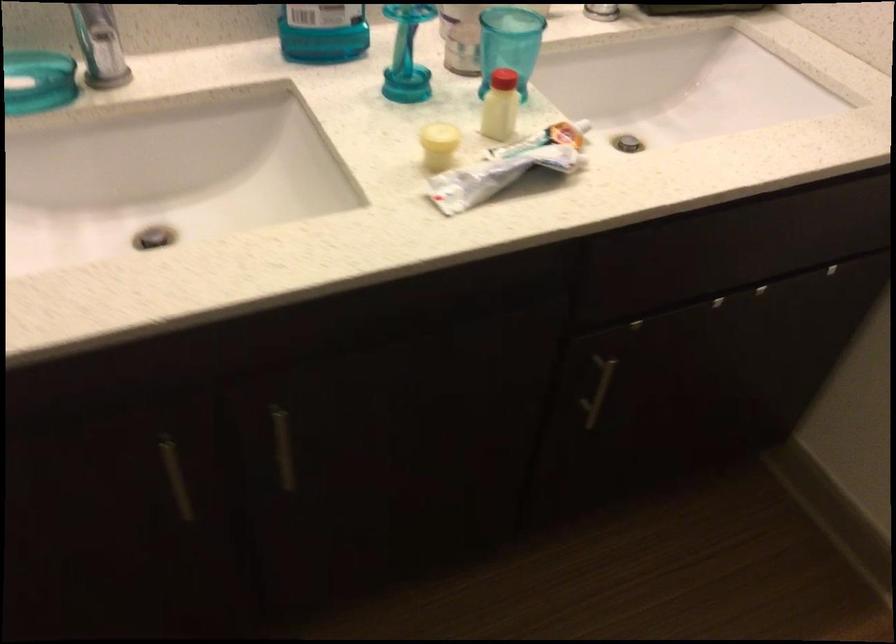
Where would you unscrew the small white bottle? Please return your answer as a coordinate pair (x, y).

(501, 106)